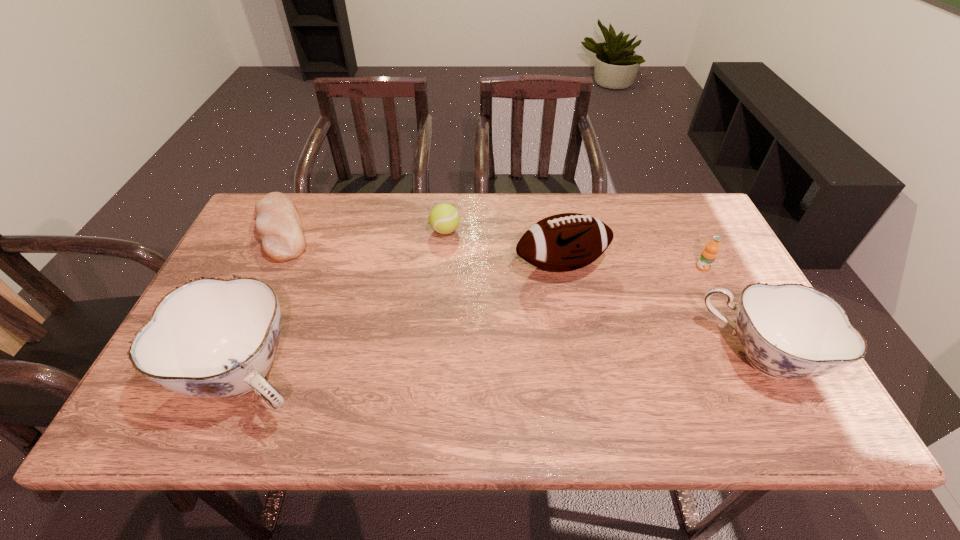
I want to click on the taller chinaware, so click(x=210, y=338).

Find the location of a particular element. The height and width of the screenshot is (540, 960). the shorter chinaware is located at coordinates (790, 331).

At what (x,y) coordinates should I click in order to perform the action: click on the shortest object. Please return your answer as a coordinate pair (x, y). The height and width of the screenshot is (540, 960). Looking at the image, I should click on (278, 224).

Locate an element on the screen. This screenshot has height=540, width=960. the third shortest object is located at coordinates (708, 255).

Where is `the second shortest object`? Image resolution: width=960 pixels, height=540 pixels. the second shortest object is located at coordinates (444, 218).

Identify the location of the fourth object from right to left. This screenshot has height=540, width=960. (444, 218).

In order to click on football (American) in this screenshot , I will do `click(564, 242)`.

Find the location of a particular element. The height and width of the screenshot is (540, 960). vacant space located on the back of the left chinaware is located at coordinates (289, 280).

I want to click on free space located on the left of the right chinaware, so click(568, 357).

Identify the location of blank area located on the right of the shortest object. (335, 230).